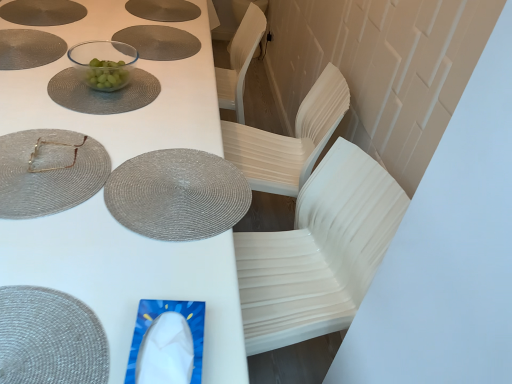
You are a GUI agent. You are given a task and a screenshot of the screen. Output one action in this format:
    pyautogui.click(x=<x>, y=<y>)
    Task: Click on the vacant region in front of clear glass bowl at upper center, marked as the first tableware in a back-to-front arrangement
    
    Given the screenshot: What is the action you would take?
    pos(79,107)